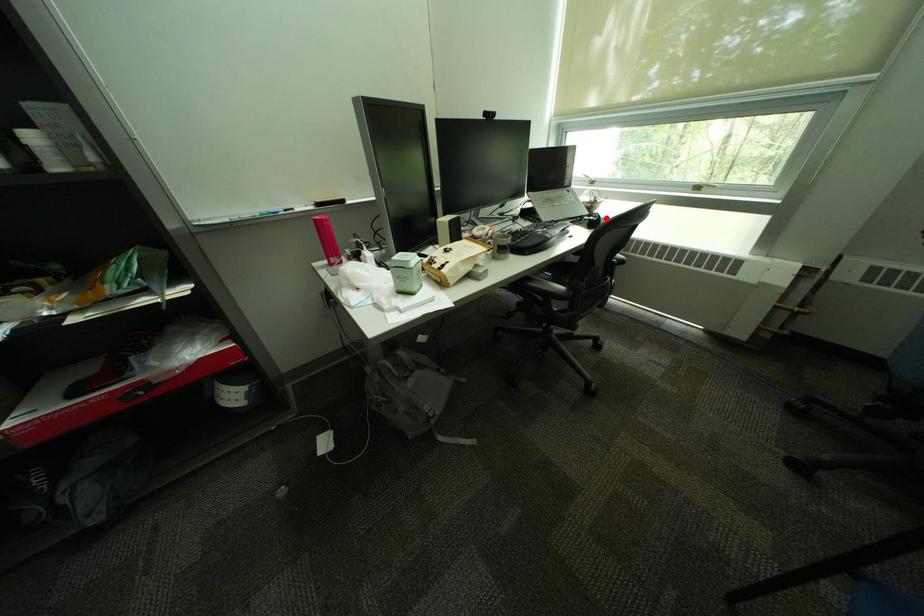
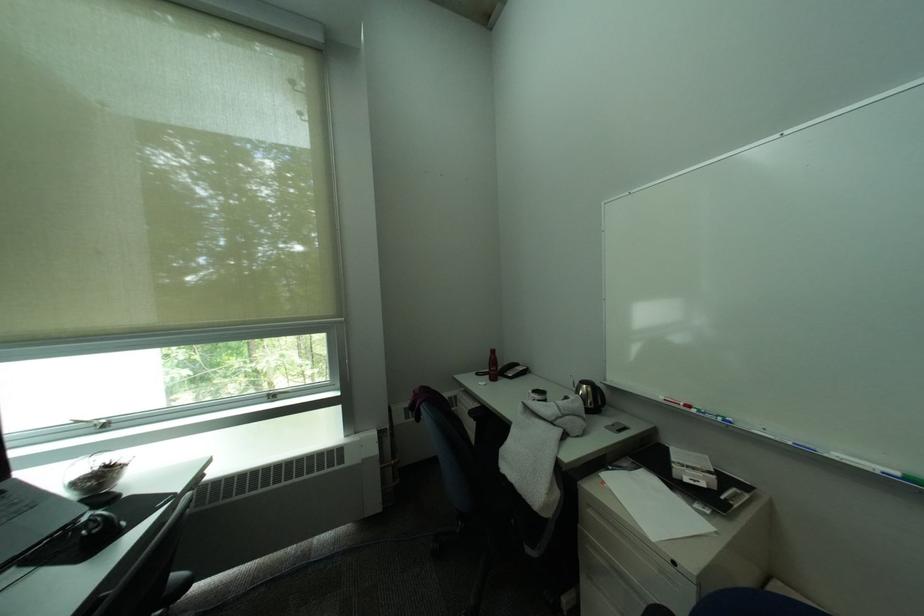
In the second image, find the point that corresponds to the highlighted location in the first image.

(106, 528)